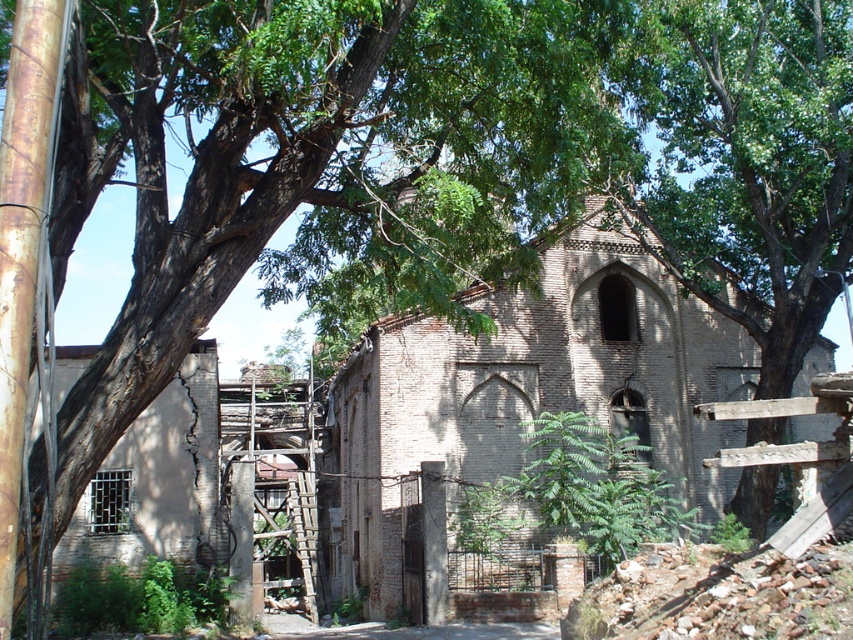
You are standing in front of the brown brick church at center and the green leafy tree at center. Which one is positioned to the left?

The brown brick church at center is positioned to the left of the green leafy tree at center.

You are a painter who needs to determine which object requires a taller ladder to reach its top. Based on the scene, which object is taller between the brown brick church at center and the rusty wooden ladder at center?

The brown brick church at center is much taller than the rusty wooden ladder at center, so the painter would need a taller ladder to reach its top.